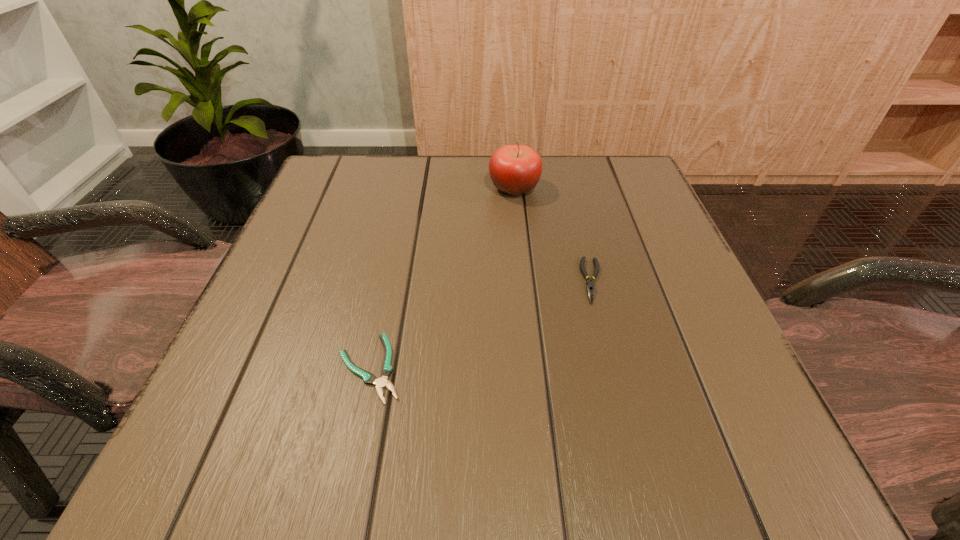
This screenshot has width=960, height=540. I want to click on vacant region between the second object from left to right and the right pliers, so click(x=553, y=234).

Find the location of a particular element. Image resolution: width=960 pixels, height=540 pixels. empty space between the right pliers and the nearer pliers is located at coordinates (481, 325).

At what (x,y) coordinates should I click in order to perform the action: click on blank region between the apple and the second tallest object. Please return your answer as a coordinate pair (x, y). The height and width of the screenshot is (540, 960). Looking at the image, I should click on (553, 234).

Where is `free spot between the nearer pliers and the second object from left to right`? Image resolution: width=960 pixels, height=540 pixels. free spot between the nearer pliers and the second object from left to right is located at coordinates (442, 278).

Identify the location of unoccupied position between the farther pliers and the apple. The image size is (960, 540). (553, 234).

Where is `empty space that is in between the right pliers and the tallest object`? The width and height of the screenshot is (960, 540). empty space that is in between the right pliers and the tallest object is located at coordinates (553, 234).

Where is `object that stands as the second closest to the left pliers`? object that stands as the second closest to the left pliers is located at coordinates (514, 169).

This screenshot has height=540, width=960. Find the location of `object that stands as the closest to the apple`. object that stands as the closest to the apple is located at coordinates (590, 285).

The height and width of the screenshot is (540, 960). Find the location of `vacant space that satisfies the following two spatial constraints: 1. on the front side of the second shortest object; 2. on the right side of the second object from right to left`. vacant space that satisfies the following two spatial constraints: 1. on the front side of the second shortest object; 2. on the right side of the second object from right to left is located at coordinates (523, 281).